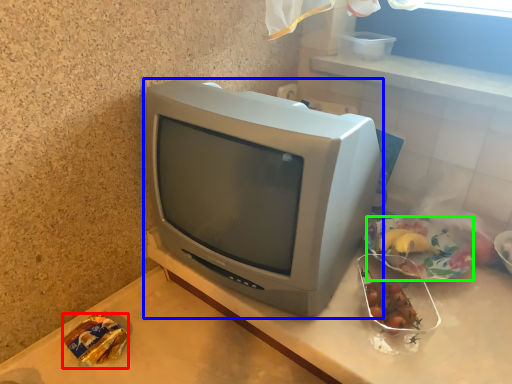
Question: Estimate the real-world distances between objects in this image. Which object is farther from food (highlighted by a red box), television (highlighted by a blue box) or food (highlighted by a green box)?

Choices:
 (A) television
 (B) food

Answer: (B)